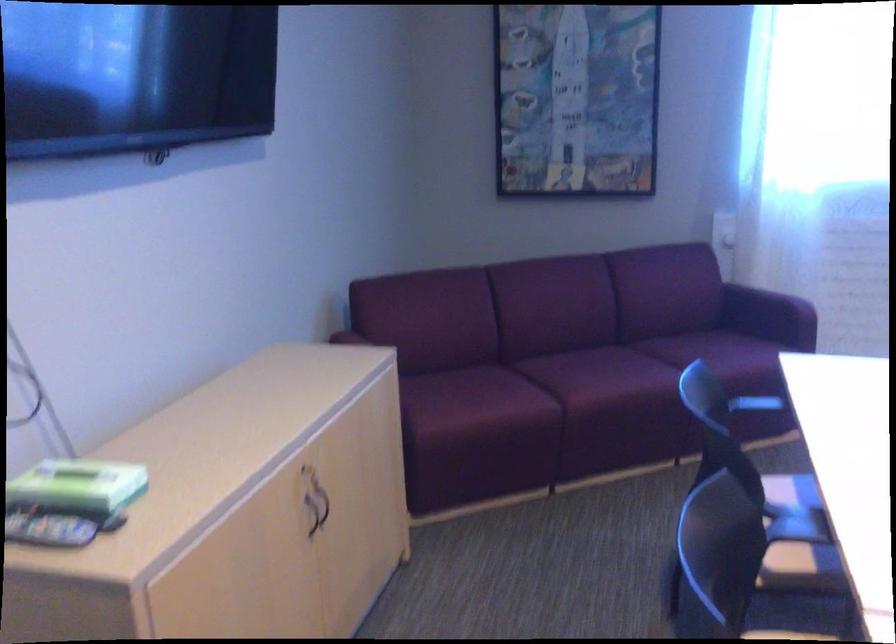
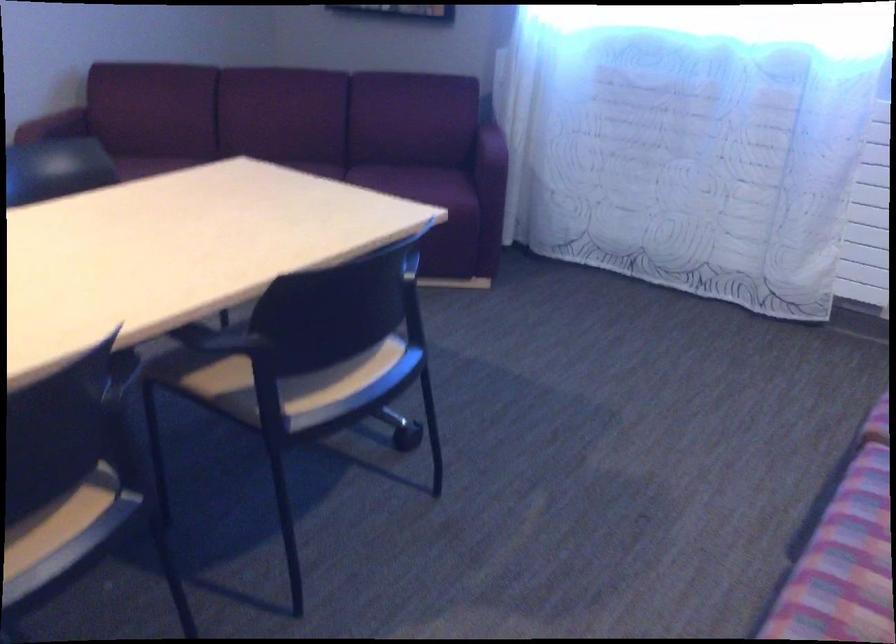
Where in the second image is the point corresponding to [764,353] from the first image?

(426, 183)